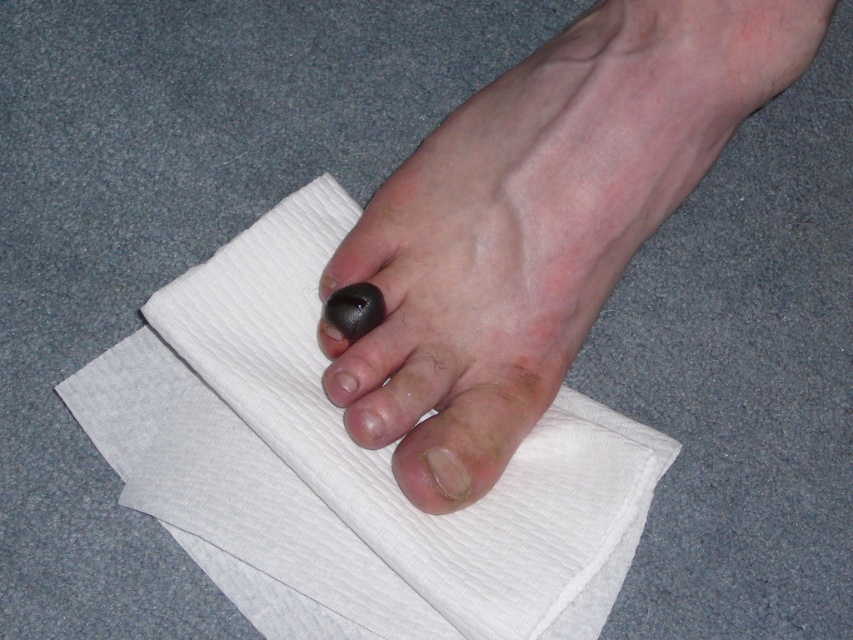
Does black matte toe at center appear over smooth skin toe at center?

Correct, black matte toe at center is located above smooth skin toe at center.

Is point (517, 67) in front of point (457, 492)?

No.

Locate an element on the screen. This screenshot has width=853, height=640. black matte toe at center is located at coordinates (538, 220).

Who is more forward, (540, 74) or (357, 300)?

Point (357, 300)

Image resolution: width=853 pixels, height=640 pixels. Describe the element at coordinates (538, 220) in the screenshot. I see `black matte toe at center` at that location.

Locate an element on the screen. The width and height of the screenshot is (853, 640). black matte toe at center is located at coordinates (538, 220).

Does white textured cloth at center have a greater width compared to smooth skin toe at center?

Indeed, white textured cloth at center has a greater width compared to smooth skin toe at center.

Between white textured cloth at center and smooth skin toe at center, which one has less height?

smooth skin toe at center

Between point (585, 545) and point (439, 484), which one is positioned behind?

The point (585, 545) is behind.

Where is `white textured cloth at center`? The image size is (853, 640). white textured cloth at center is located at coordinates (347, 465).